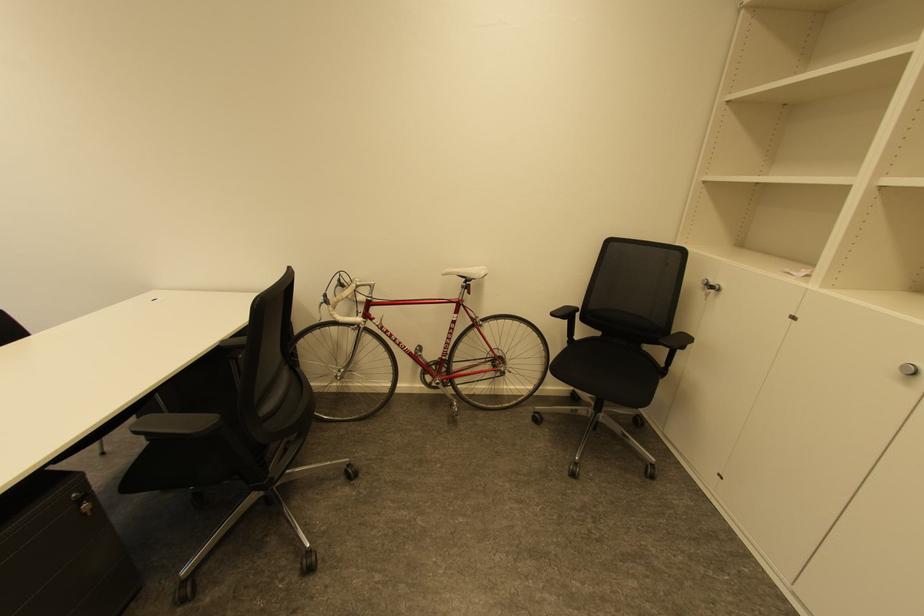
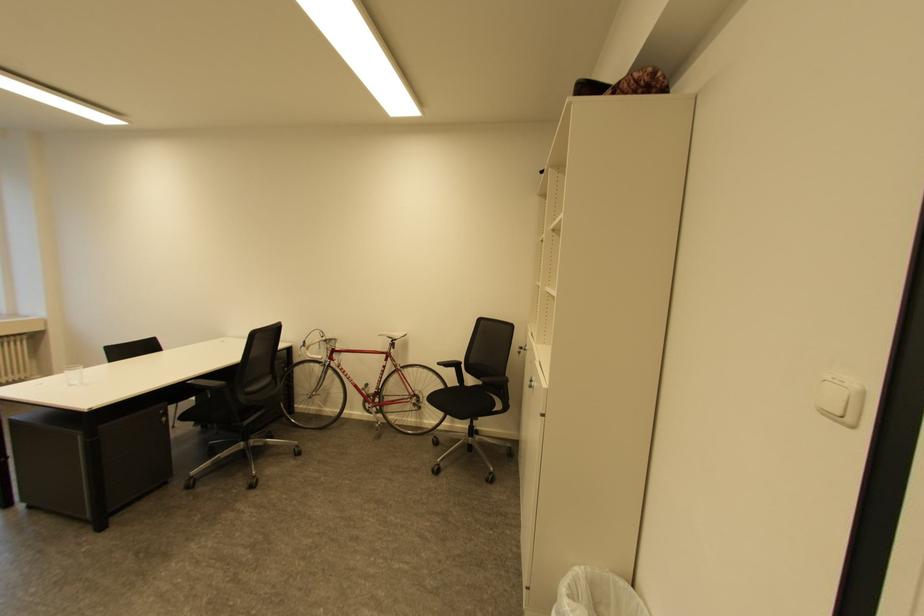
Where in the second image is the point corresponding to [332,296] from the first image?

(311, 342)